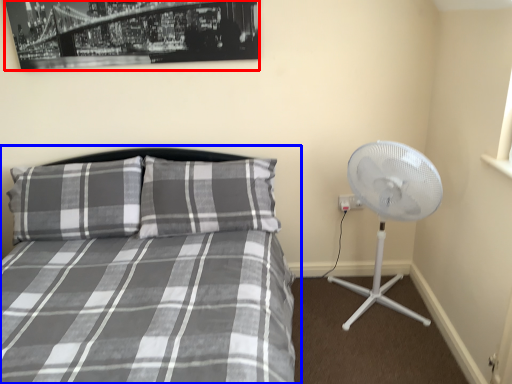
Question: Which object appears farthest to the camera in this image, picture frame (highlighted by a red box) or bed (highlighted by a blue box)?

Choices:
 (A) picture frame
 (B) bed

Answer: (A)